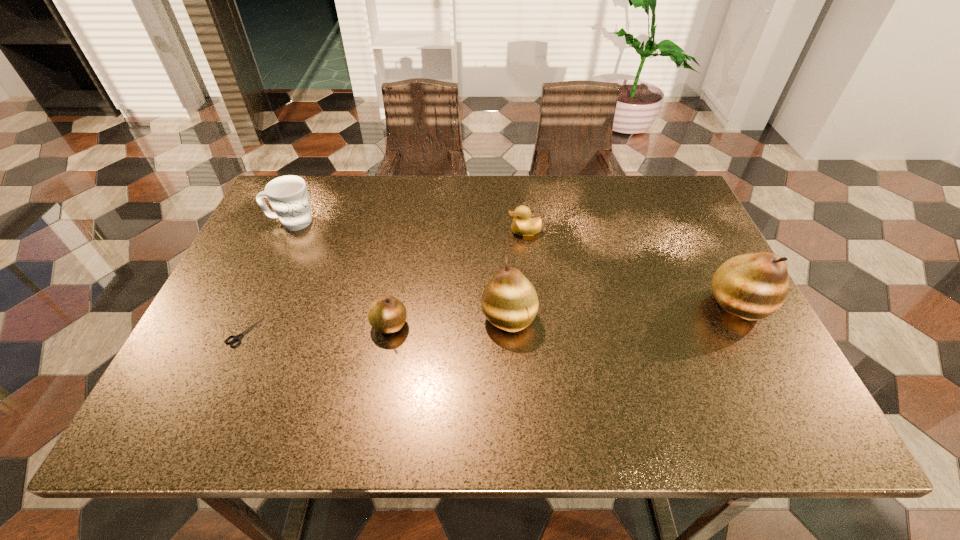
At what (x,y) coordinates should I click in order to perform the action: click on free region located on the back of the rightmost pear. Please return your answer as a coordinate pair (x, y). This screenshot has width=960, height=540. Looking at the image, I should click on (715, 262).

You are a GUI agent. You are given a task and a screenshot of the screen. Output one action in this format:
    pyautogui.click(x=<x>, y=<y>)
    Task: Click on the free point located on the side of the mug with the handle
    The image size is (960, 540).
    Given the screenshot: What is the action you would take?
    pyautogui.click(x=398, y=222)

This screenshot has height=540, width=960. In order to click on vacant area located on the right of the shortest object in this screenshot , I will do `click(409, 332)`.

At what (x,y) coordinates should I click in order to perform the action: click on free point located facing forward on the duckling. Please return your answer as a coordinate pair (x, y). Looking at the image, I should click on (376, 232).

Locate an element on the screen. free location located facing forward on the duckling is located at coordinates (442, 232).

Locate an element on the screen. Image resolution: width=960 pixels, height=540 pixels. vacant region located 0.180m facing forward on the duckling is located at coordinates [442, 232].

The width and height of the screenshot is (960, 540). I want to click on mug present at the far edge, so click(x=288, y=195).

You are a GUI agent. You are given a task and a screenshot of the screen. Output one action in this format:
    pyautogui.click(x=<x>, y=<y>)
    Task: Click on the duckling that is positioned at the far edge
    
    Given the screenshot: What is the action you would take?
    pyautogui.click(x=522, y=225)

Find the location of `mug that is at the left edge`. mug that is at the left edge is located at coordinates (288, 195).

At what (x,y) coordinates should I click in order to perform the action: click on shears present at the left edge. Please return your answer as a coordinate pair (x, y). Image resolution: width=960 pixels, height=540 pixels. Looking at the image, I should click on (235, 338).